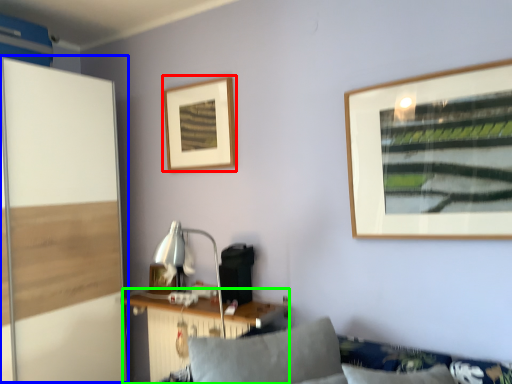
Question: Which is farther away from picture frame (highlighted by a red box)? screen door (highlighted by a blue box) or table (highlighted by a green box)?

Choices:
 (A) screen door
 (B) table

Answer: (B)